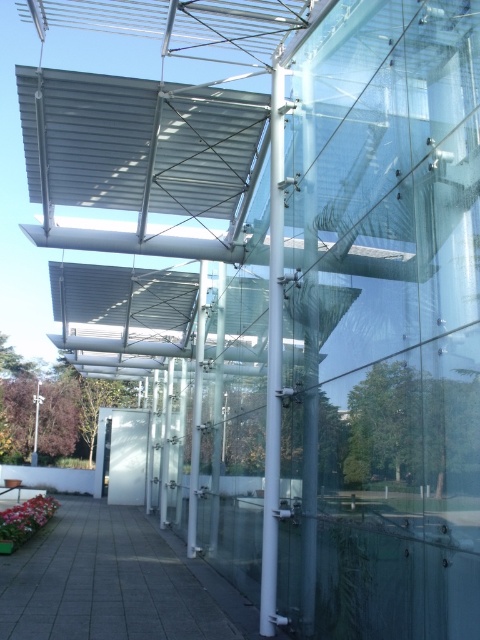
Question: Which is nearer to the metallic gray canopy at upper center?

Choices:
 (A) white glossy pillar at center
 (B) clear glass pillar at center

Answer: (B)

Question: Is white glossy pole at center positioned in front of clear glass pillar at center?

Choices:
 (A) no
 (B) yes

Answer: (B)

Question: Is white glossy pillar at center to the left of clear glass pillar at center from the viewer's perspective?

Choices:
 (A) yes
 (B) no

Answer: (A)

Question: Is white glossy pole at center bigger than white glossy pillar at center?

Choices:
 (A) yes
 (B) no

Answer: (B)

Question: Estimate the real-world distances between objects in this image. Which object is closer to the white glossy pole at center?

Choices:
 (A) white glossy pillar at center
 (B) clear glass pillar at center
 (C) metallic gray canopy at upper center

Answer: (B)

Question: Among these points, which one is nearest to the camera?

Choices:
 (A) (218, 346)
 (B) (280, 292)
 (C) (43, 120)

Answer: (B)